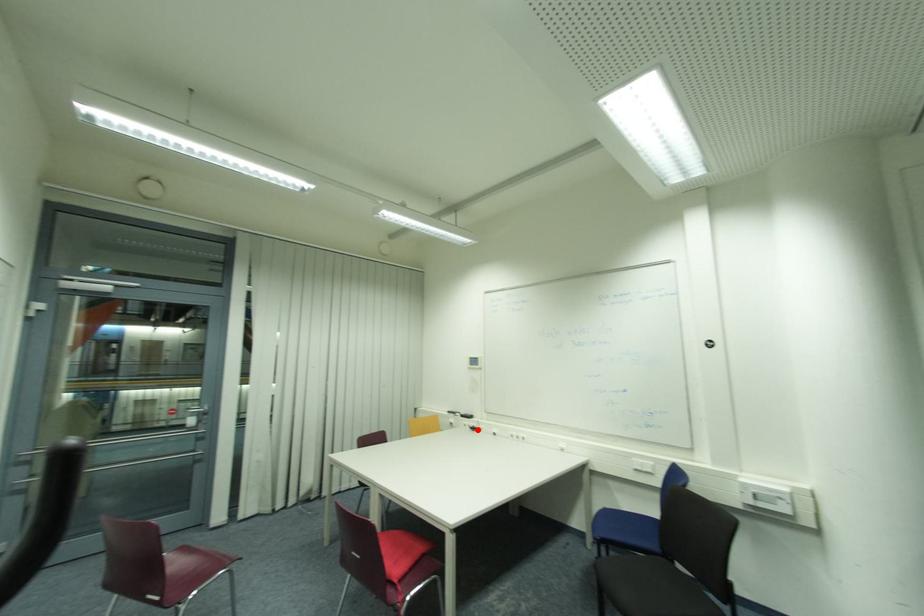
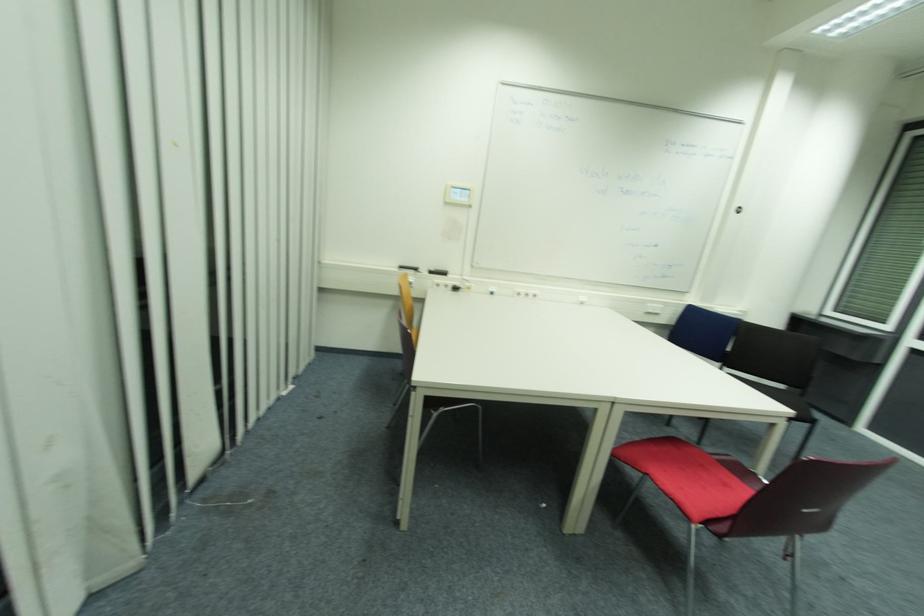
Question: I am providing you with two images of the same scene from different viewpoints. In image1, a red point is highlighted. Considering the same 3D point in image2, which of the following is correct?

Choices:
 (A) It is closer
 (B) It is farther

Answer: (A)